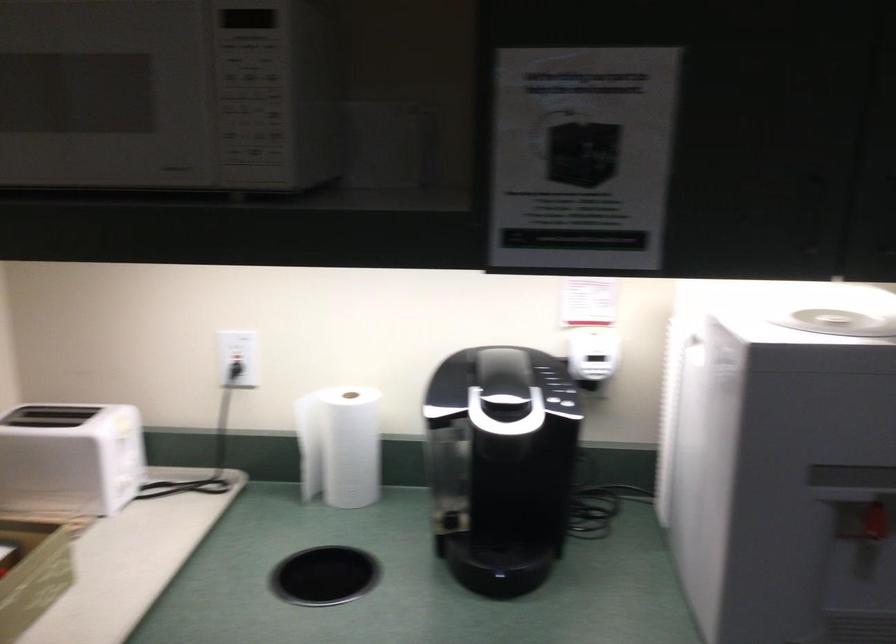
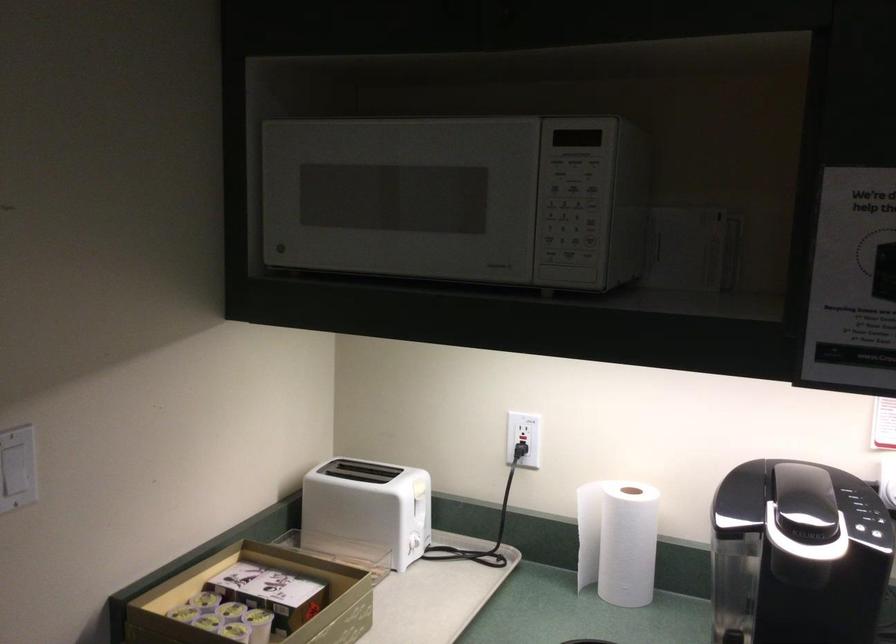
Where in the second image is the point corresponding to [250,111] from the first image?

(569, 220)